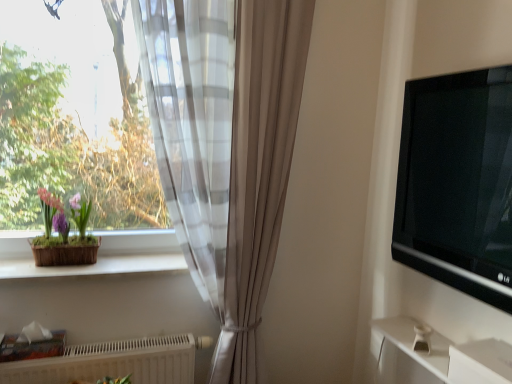
Question: Can you confirm if white textured radiator at lower left is bigger than matte brown pot at left?

Choices:
 (A) yes
 (B) no

Answer: (A)

Question: Can you confirm if white textured radiator at lower left is wider than matte brown pot at left?

Choices:
 (A) yes
 (B) no

Answer: (B)

Question: Is white textured radiator at lower left further to the viewer compared to matte brown pot at left?

Choices:
 (A) no
 (B) yes

Answer: (A)

Question: Can you confirm if white textured radiator at lower left is shorter than matte brown pot at left?

Choices:
 (A) yes
 (B) no

Answer: (A)

Question: Is white textured radiator at lower left to the left of matte brown pot at left from the viewer's perspective?

Choices:
 (A) yes
 (B) no

Answer: (B)

Question: Looking at the image, does black glossy tv at right seem bigger or smaller compared to translucent glass window at left?

Choices:
 (A) small
 (B) big

Answer: (A)

Question: Choose the correct answer: Is black glossy tv at right inside translucent glass window at left or outside it?

Choices:
 (A) inside
 (B) outside

Answer: (B)

Question: Looking at their shapes, would you say black glossy tv at right is wider or thinner than translucent glass window at left?

Choices:
 (A) thin
 (B) wide

Answer: (A)

Question: From their relative heights in the image, would you say black glossy tv at right is taller or shorter than translucent glass window at left?

Choices:
 (A) tall
 (B) short

Answer: (B)

Question: In terms of height, does white smooth window sill at lower left look taller or shorter compared to sheer white curtain at left?

Choices:
 (A) tall
 (B) short

Answer: (B)

Question: From a real-world perspective, is white smooth window sill at lower left positioned above or below sheer white curtain at left?

Choices:
 (A) above
 (B) below

Answer: (B)

Question: Is point (138, 258) closer or farther from the camera than point (206, 140)?

Choices:
 (A) closer
 (B) farther

Answer: (B)

Question: From the image's perspective, is white smooth window sill at lower left located above or below sheer white curtain at left?

Choices:
 (A) above
 (B) below

Answer: (B)

Question: Does point (74, 258) appear closer or farther from the camera than point (398, 249)?

Choices:
 (A) closer
 (B) farther

Answer: (B)

Question: Is matte brown pot at left situated inside black glossy tv at right or outside?

Choices:
 (A) inside
 (B) outside

Answer: (B)